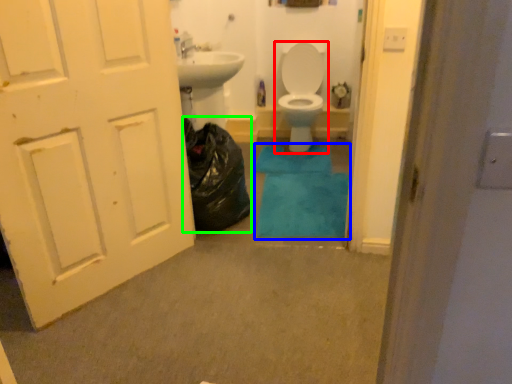
Question: Which object is the closest to the toilet (highlighted by a red box)? Choose among these: bath mat (highlighted by a blue box) or garbage (highlighted by a green box).

Choices:
 (A) bath mat
 (B) garbage

Answer: (A)